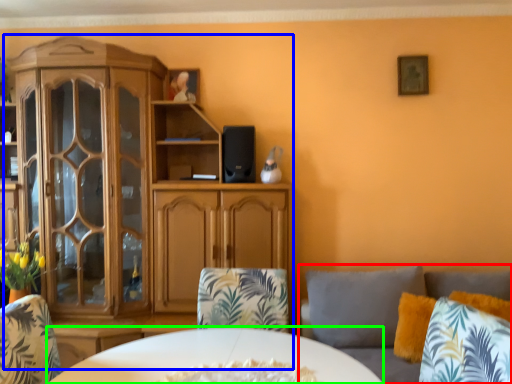
Question: Which object is the closest to the studio couch (highlighted by a red box)? Choose among these: cabinetry (highlighted by a blue box) or desk (highlighted by a green box).

Choices:
 (A) cabinetry
 (B) desk

Answer: (B)